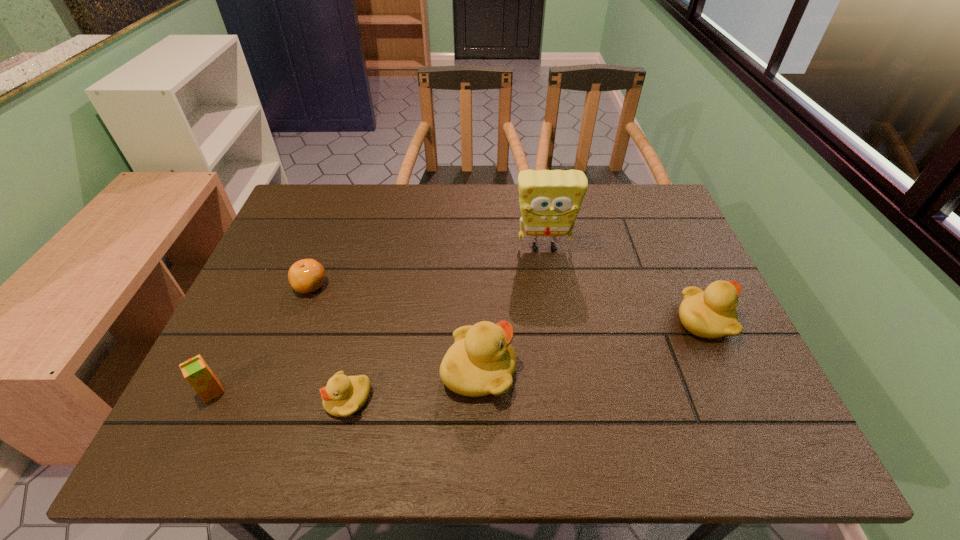
Where is `vacant space located 0.070m on the front-facing side of the shortest duckling`? This screenshot has width=960, height=540. vacant space located 0.070m on the front-facing side of the shortest duckling is located at coordinates (292, 400).

Locate an element on the screen. This screenshot has width=960, height=540. vacant space located on the front-facing side of the shortest duckling is located at coordinates (263, 400).

The image size is (960, 540). I want to click on vacant region located 0.150m on the front-facing side of the second duckling from left to right, so click(x=585, y=370).

Locate an element on the screen. vacant area located 0.200m on the back of the clementine is located at coordinates (332, 227).

Identify the location of vacant space situated on the face of the tallest object. [561, 354].

Where is `free location located on the right of the orange juice`? The image size is (960, 540). free location located on the right of the orange juice is located at coordinates (325, 392).

Locate an element on the screen. Image resolution: width=960 pixels, height=540 pixels. orange juice located in the near edge section of the desktop is located at coordinates [198, 374].

Find the location of a particular element. The image size is (960, 540). clementine present at the left edge is located at coordinates (305, 276).

You are a GUI agent. You are given a task and a screenshot of the screen. Output one action in this format:
    pyautogui.click(x=<x>, y=<y>)
    Task: Click on the orange juice that is at the left edge
    This screenshot has width=960, height=540.
    Given the screenshot: What is the action you would take?
    pyautogui.click(x=198, y=374)

The height and width of the screenshot is (540, 960). Find the location of `object that is positioned at the right edge`. object that is positioned at the right edge is located at coordinates (712, 313).